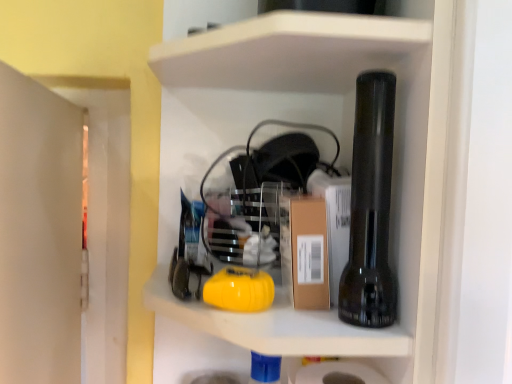
Locate an element on the screen. vacant space in front of brown cardboard box at center is located at coordinates (311, 331).